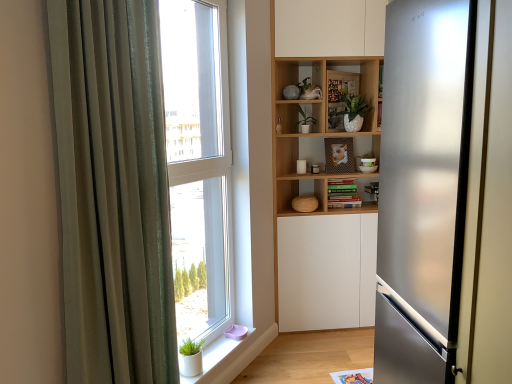
Image resolution: width=512 pixels, height=384 pixels. Find the location of `vacant space situated above wooden bookshelf at center (from a real-world perspective)`. vacant space situated above wooden bookshelf at center (from a real-world perspective) is located at coordinates (325, 58).